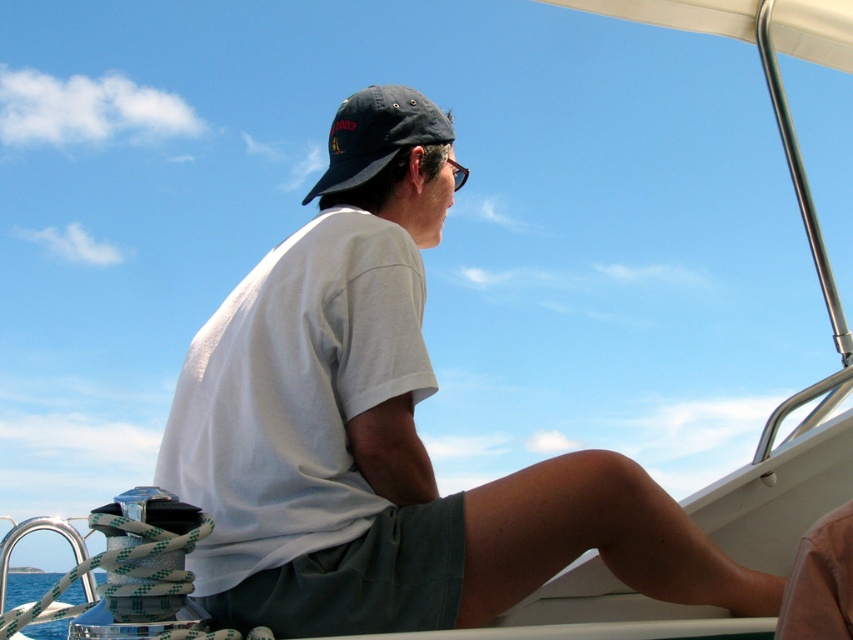
You are a photographer trying to capture the blue water at lower left and the transparent plastic goggles at upper center in the same frame. Based on their sizes in the image, which object will appear larger in your photo?

The blue water at lower left will appear larger in the photo since it is bigger than the transparent plastic goggles at upper center according to the description.

You are standing on the deck of a boat and want to hand a life jacket to the person wearing the white cotton shirt at center. If the life jacket is 2 meters away from you, can you reach them without moving?

The white cotton shirt at center is 6.31 feet away from you. Since 6.31 feet is approximately 1.92 meters, which is slightly less than 2 meters, you can just barely reach them without moving.

You are a photographer trying to capture a candid shot of the person in the scene. You need to ensure both the white cotton shirt at center and the dark blue fabric baseball cap at upper center are visible in the frame. Based on their positions, which object should you focus on first to ensure both are in the shot?

The white cotton shirt at center is positioned on the right side of the dark blue fabric baseball cap at upper center. To ensure both are in the frame, focus on the dark blue fabric baseball cap at upper center first, as it is on the left side, allowing the shirt to naturally fall into the shot to the right.